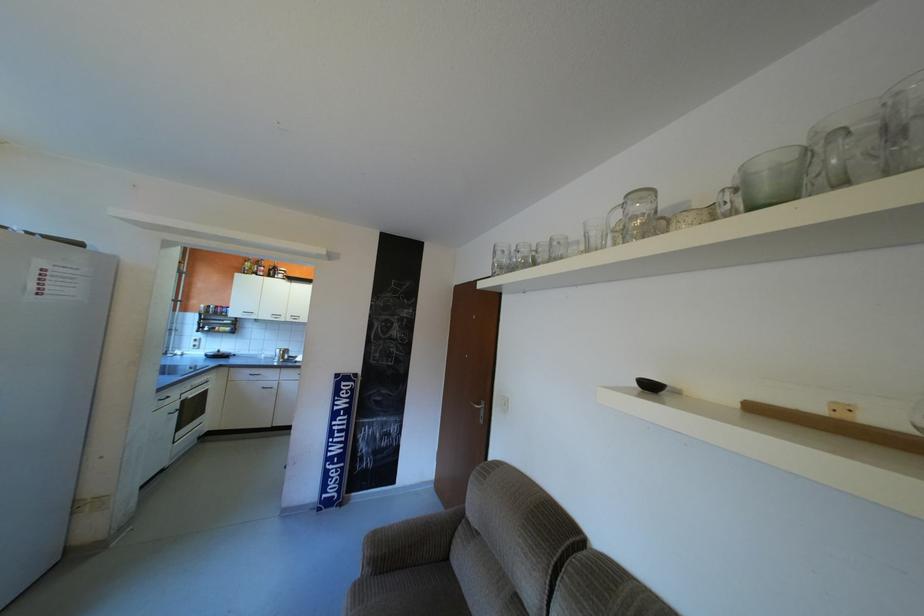
Identify the location of blue street sign. (337, 440).